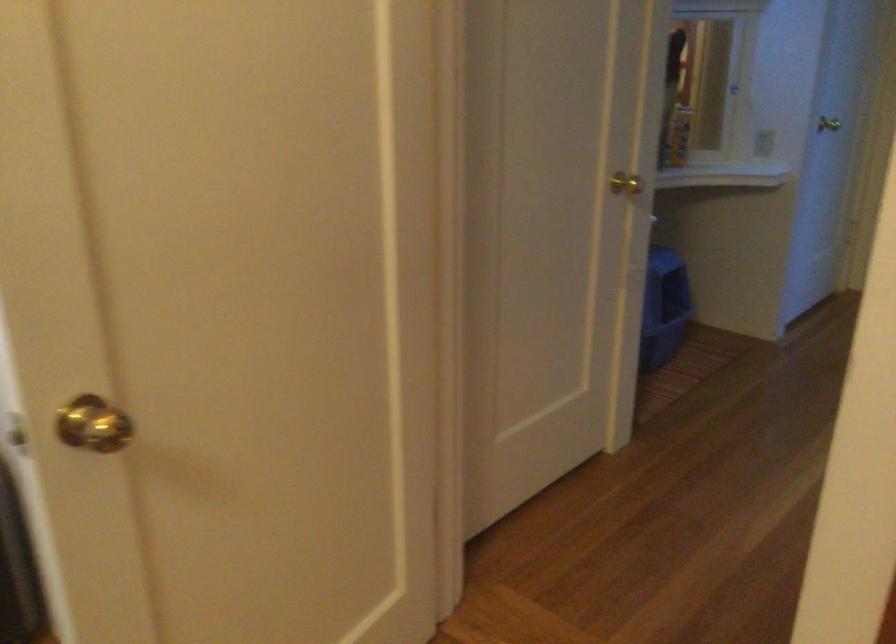
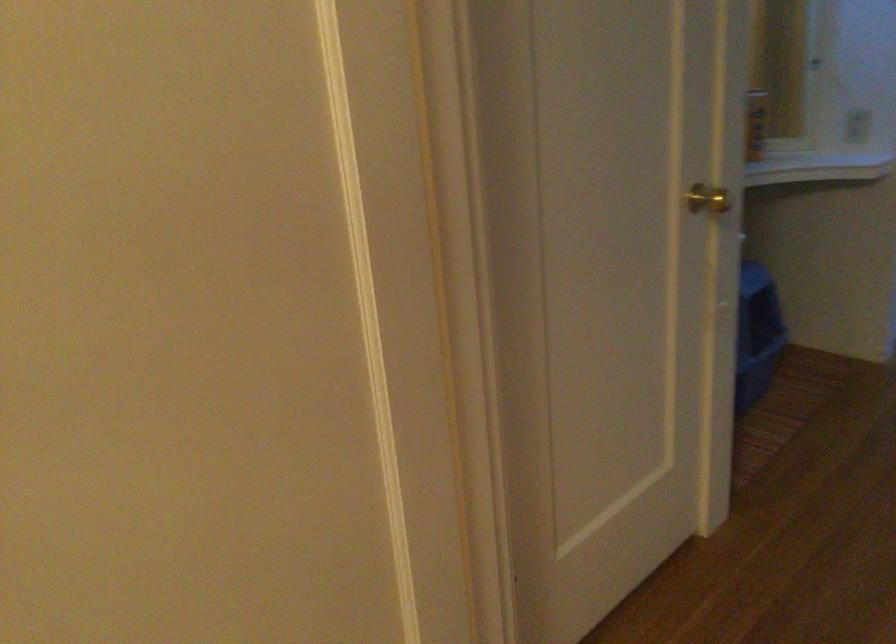
Question: The images are taken continuously from a first-person perspective. In which direction is your viewpoint rotating?

Choices:
 (A) Left
 (B) Right
 (C) Up
 (D) Down

Answer: (A)